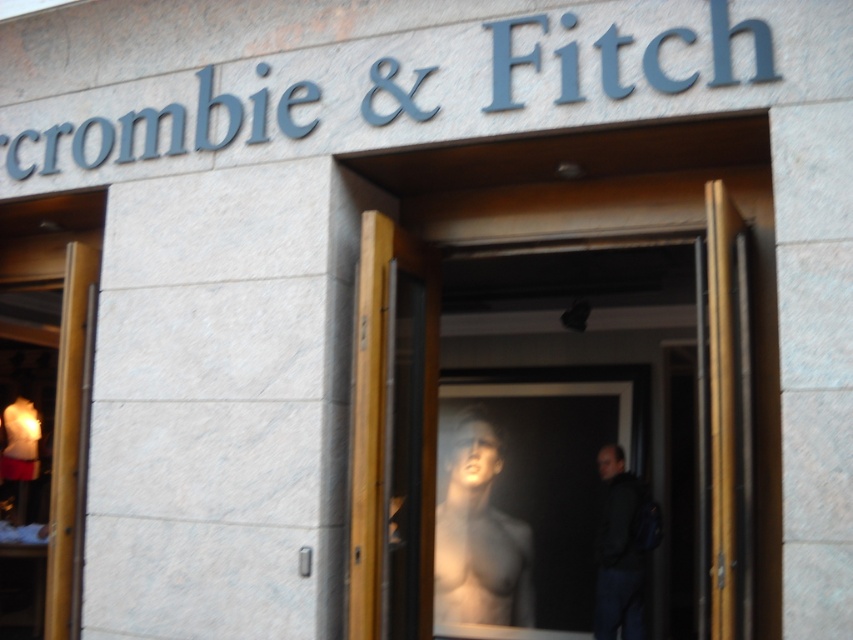
What do you see at coordinates (479, 536) in the screenshot? This screenshot has width=853, height=640. I see `smooth skin torso at center` at bounding box center [479, 536].

Is smooth skin torso at center wider than dark blue jacket at center?

Correct, the width of smooth skin torso at center exceeds that of dark blue jacket at center.

Between point (525, 620) and point (618, 564), which one is positioned in front?

Point (618, 564) is more forward.

Locate an element on the screen. The width and height of the screenshot is (853, 640). smooth skin torso at center is located at coordinates (479, 536).

Between transparent glass mannequin torso at center and smooth skin torso at center, which one appears on the right side from the viewer's perspective?

transparent glass mannequin torso at center

Who is positioned more to the left, transparent glass mannequin torso at center or smooth skin torso at center?

Positioned to the left is smooth skin torso at center.

Identify the location of transparent glass mannequin torso at center. The height and width of the screenshot is (640, 853). (521, 502).

Find the location of `transparent glass mannequin torso at center`. transparent glass mannequin torso at center is located at coordinates (521, 502).

Looking at this image, can you confirm if wooden at center is smaller than smooth skin torso at center?

Incorrect, wooden at center is not smaller in size than smooth skin torso at center.

Does point (370, 429) come in front of point (527, 621)?

Yes, point (370, 429) is closer to viewer.

Image resolution: width=853 pixels, height=640 pixels. What do you see at coordinates (393, 435) in the screenshot?
I see `wooden at center` at bounding box center [393, 435].

Find the location of a particular element. This screenshot has height=640, width=853. wooden at center is located at coordinates (393, 435).